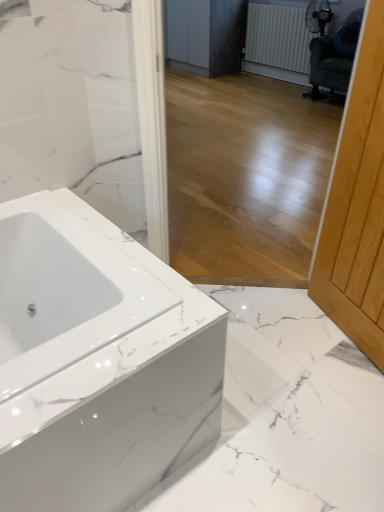
Identify the location of vacant region to the left of light wood screen door at right. The height and width of the screenshot is (512, 384). (286, 340).